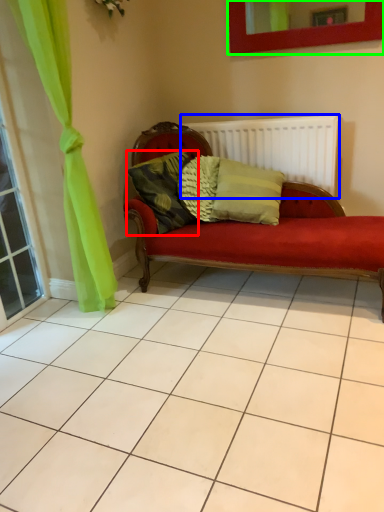
Question: Which object is positioned farthest from pillow (highlighted by a red box)? Select from radiator (highlighted by a blue box) and picture frame (highlighted by a green box).

Choices:
 (A) radiator
 (B) picture frame

Answer: (B)